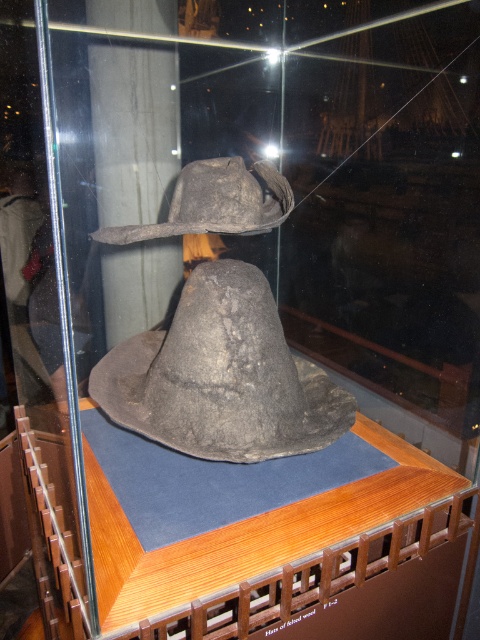
Question: Can you confirm if dark gray felt hat at center is bigger than dark gray felt hat at upper center?

Choices:
 (A) yes
 (B) no

Answer: (A)

Question: Does dark gray felt hat at center appear under dark gray felt hat at upper center?

Choices:
 (A) yes
 (B) no

Answer: (A)

Question: Is dark gray felt hat at center bigger than dark gray felt hat at upper center?

Choices:
 (A) no
 (B) yes

Answer: (B)

Question: Among these objects, which one is nearest to the camera?

Choices:
 (A) dark gray felt hat at center
 (B) dark gray felt hat at upper center

Answer: (B)

Question: Among these points, which one is nearest to the camera?

Choices:
 (A) coord(229,180)
 (B) coord(289,380)

Answer: (A)